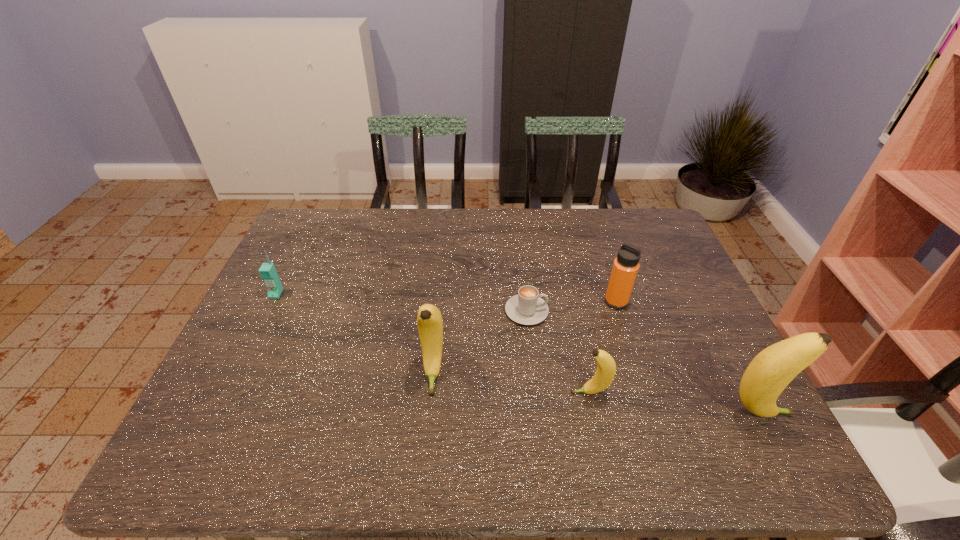
You are a GUI agent. You are given a task and a screenshot of the screen. Output one action in this format:
    pyautogui.click(x=<x>, y=<y>)
    Task: Click on the vacant space that satisfies the following two spatial constraints: 1. on the front side of the fifth object from left to right; 2. to the right of the cappuccino
    
    Given the screenshot: What is the action you would take?
    pyautogui.click(x=619, y=311)

I want to click on free location that satisfies the following two spatial constraints: 1. to the right of the third object from left to right; 2. from the stem of the fifth object from right to left, so click(x=533, y=373).